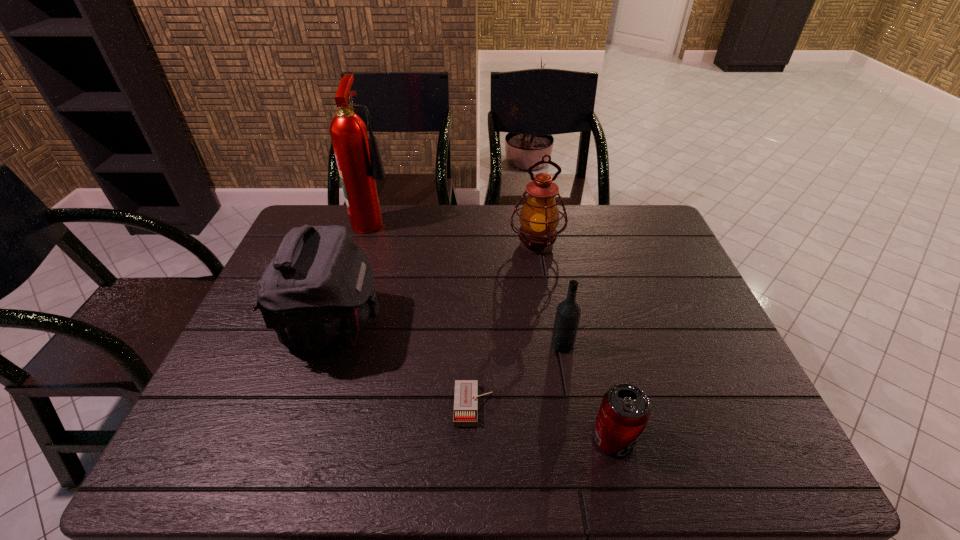
Locate an element on the screen. This screenshot has height=540, width=960. fire extinguisher is located at coordinates (359, 163).

This screenshot has width=960, height=540. What are the coordinates of `oil lamp` in the screenshot? It's located at (539, 217).

At what (x,y) coordinates should I click in order to perform the action: click on shoulder bag. Please return your answer as a coordinate pair (x, y). The width and height of the screenshot is (960, 540). Looking at the image, I should click on (316, 293).

I want to click on the third shortest object, so click(568, 312).

Where is `soda can`? The height and width of the screenshot is (540, 960). soda can is located at coordinates (625, 409).

The image size is (960, 540). I want to click on the fourth object from right to left, so click(466, 396).

This screenshot has height=540, width=960. What are the coordinates of `the shortest object` in the screenshot? It's located at (466, 396).

The height and width of the screenshot is (540, 960). What are the coordinates of `free space located at the nozzle of the tallest object` in the screenshot? It's located at (490, 219).

Image resolution: width=960 pixels, height=540 pixels. What are the coordinates of `free space located on the front of the oil lamp` in the screenshot? It's located at (552, 341).

The image size is (960, 540). Find the location of `vacant space located 0.290m on the open flap of the shoulder bag`. vacant space located 0.290m on the open flap of the shoulder bag is located at coordinates (490, 327).